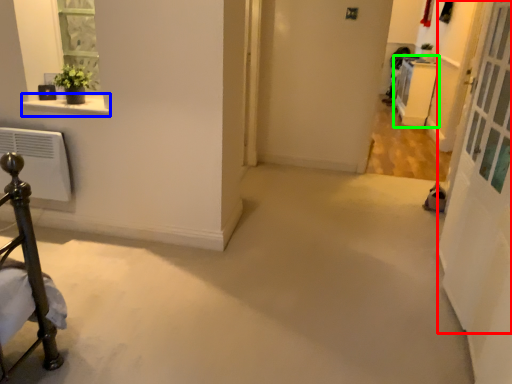
Question: Which object is positioned closest to screen door (highlighted by a red box)? Select from window sill (highlighted by a blue box) and furniture (highlighted by a green box).

Choices:
 (A) window sill
 (B) furniture

Answer: (A)